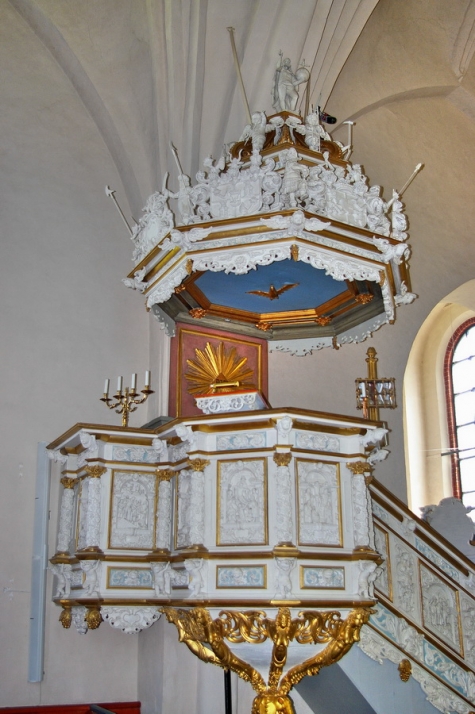
The width and height of the screenshot is (475, 714). In order to click on gold trim on red picture in this screenshot , I will do `click(197, 333)`, `click(178, 351)`, `click(258, 363)`.